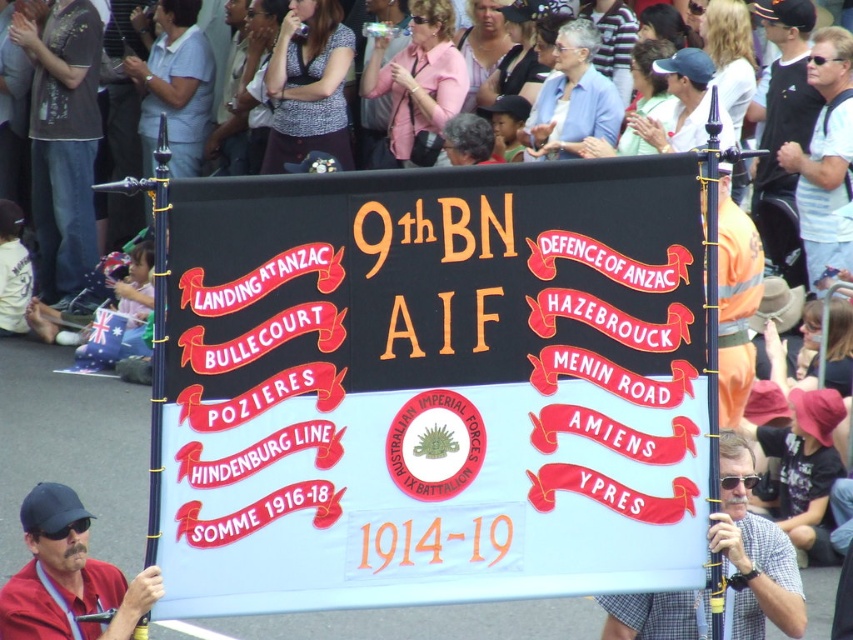
In the scene shown: You are a photographer at the event and want to capture a photo of both the dark gray shirt at center and the white striped shirt at upper right in the same frame. Which shirt should you focus on first to ensure both are in the frame?

You should focus on the dark gray shirt at center first since it is taller than the white striped shirt at upper right, ensuring it fits within the frame while also capturing the smaller one.

You are a photographer at the event and want to capture a photo of both the dark gray shirt at center and the white striped shirt at upper right in the same frame. Based on their positions, which shirt should you focus on first to ensure both are in the photo?

The dark gray shirt at center is above the white striped shirt at upper right, so focusing on the dark gray shirt at center first will ensure both are in the photo since it is positioned higher up.

You are a photographer trying to capture the banner in the center of the parade. You notice two points marked on your camera screen at coordinates point [302,445] and point [675,595]. Which point should you focus on if you want to ensure the closest part of the banner is in sharp focus?

You should focus on point [302,445] because it is closer to the viewer than point [675,595], ensuring the closest part of the banner is in sharp focus.